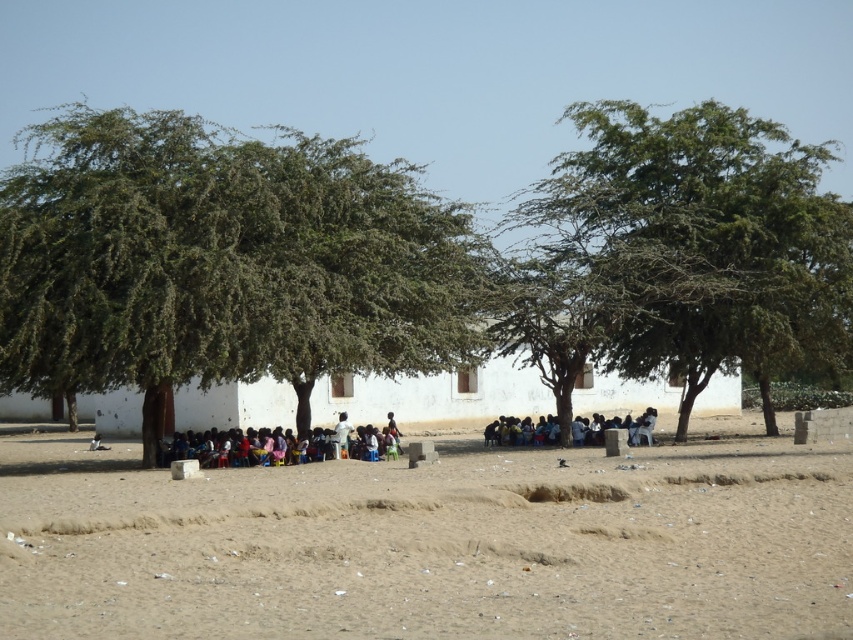
Question: Which object is positioned closest to the brown sandy dirt field at center?

Choices:
 (A) dark blue fabric at center
 (B) multicolored clothing at center
 (C) green leafy tree at left

Answer: (B)

Question: Can you confirm if brown sandy dirt field at center is positioned below dark skin person at lower left?

Choices:
 (A) yes
 (B) no

Answer: (B)

Question: Which of these objects is positioned closest to the dark skin person at lower left?

Choices:
 (A) dark blue fabric at center
 (B) multicolored clothing at center

Answer: (B)

Question: Can you confirm if green leafy tree at center is wider than dark skin person at lower left?

Choices:
 (A) yes
 (B) no

Answer: (A)

Question: Where is brown sandy dirt field at center located in relation to green leafy tree at left in the image?

Choices:
 (A) left
 (B) right

Answer: (B)

Question: Which of these objects is positioned closest to the white matte building at center?

Choices:
 (A) multicolored clothing at center
 (B) green leafy tree at center
 (C) brown sandy dirt field at center
 (D) green leafy tree at left

Answer: (A)